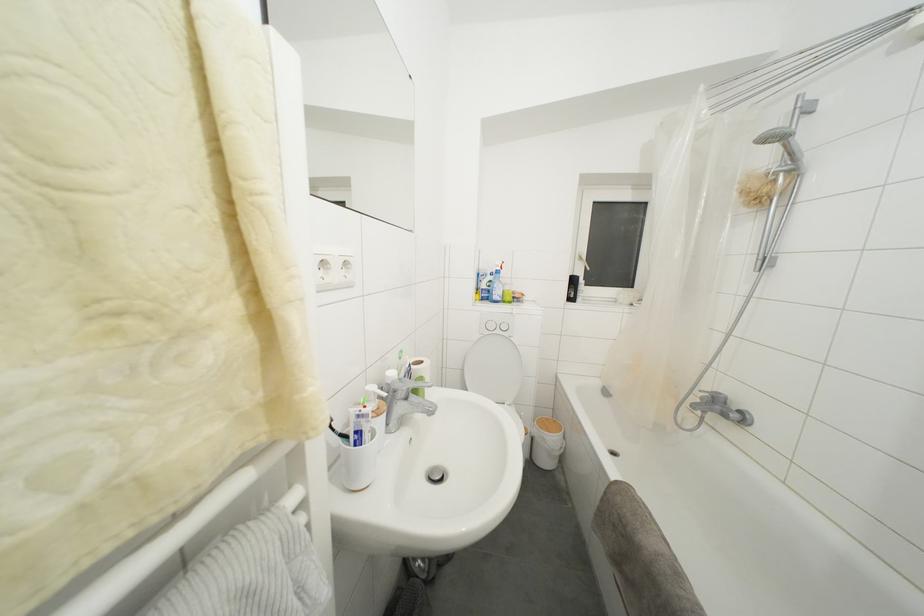
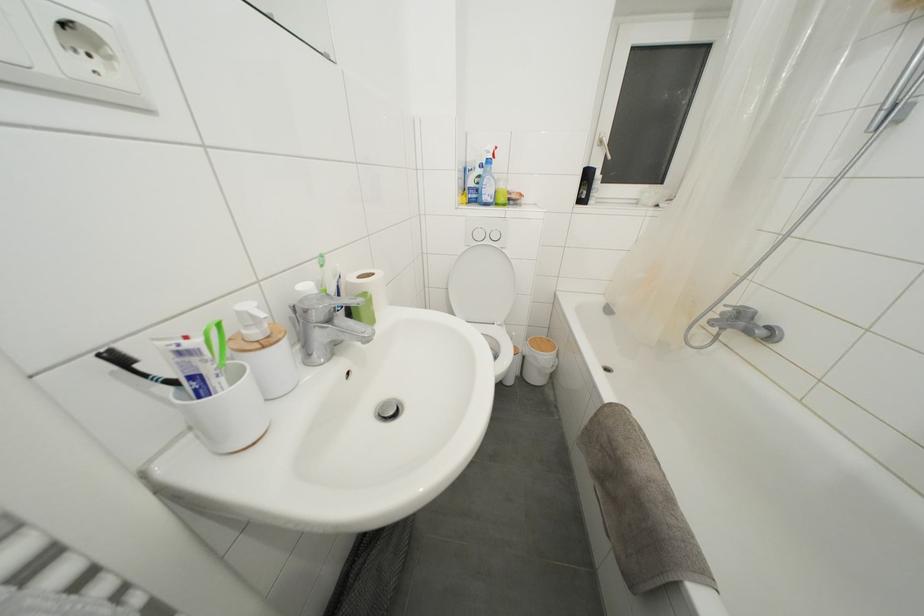
Where in the second image is the point corresponding to point (513, 344) from the first image?

(505, 256)